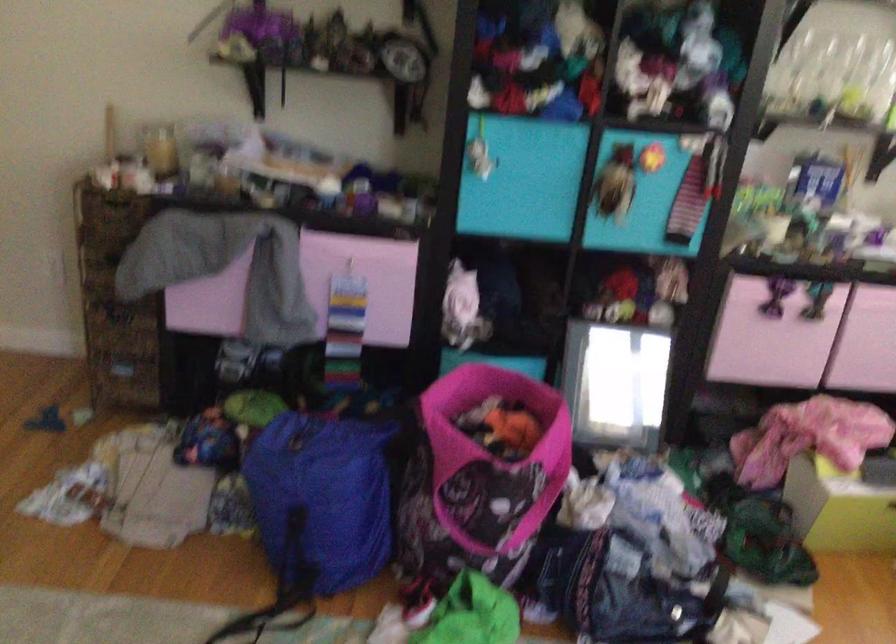
Question: The images are taken continuously from a first-person perspective. In which direction is your viewpoint rotating?

Choices:
 (A) Left
 (B) Right
 (C) Up
 (D) Down

Answer: (B)